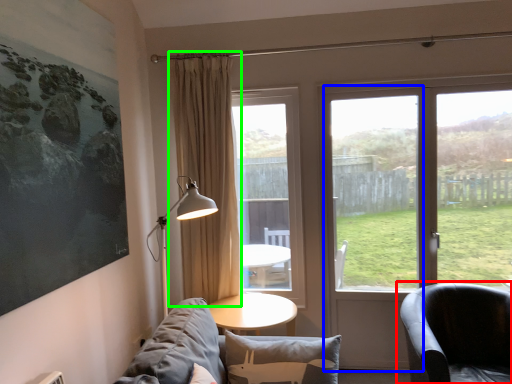
Question: Based on their relative distances, which object is nearer to chair (highlighted by a red box)? Choose from screen door (highlighted by a blue box) and curtain (highlighted by a green box).

Choices:
 (A) screen door
 (B) curtain

Answer: (A)